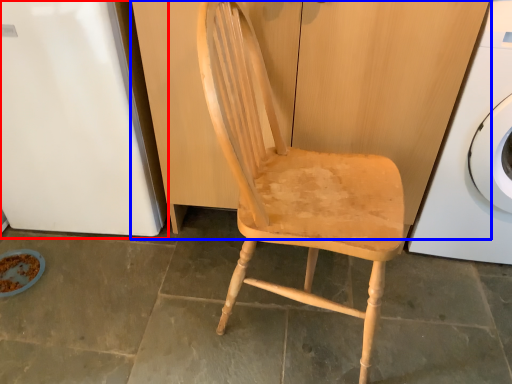
Question: Which object appears closest to the camera in this image, leftover (highlighted by a red box) or dresser (highlighted by a blue box)?

Choices:
 (A) leftover
 (B) dresser

Answer: (B)